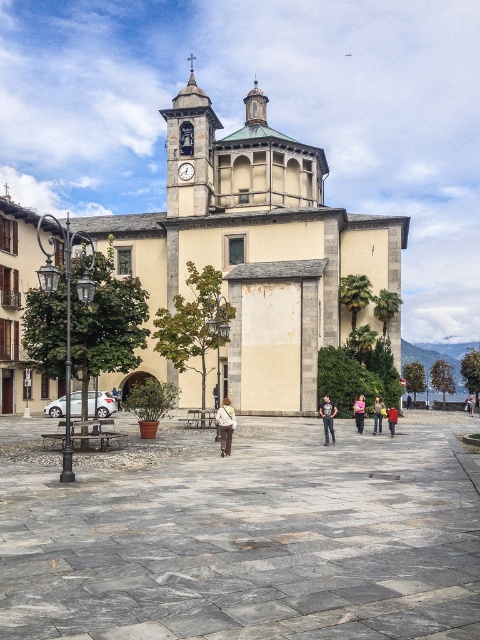
Question: Is dark blue jeans at center to the right of denim jacket at center from the viewer's perspective?

Choices:
 (A) no
 (B) yes

Answer: (A)

Question: Which of the following is the farthest from the observer?

Choices:
 (A) (233, 413)
 (B) (294, 609)

Answer: (A)

Question: Can you confirm if yellow stone church at center is bigger than dark blue jeans at center?

Choices:
 (A) no
 (B) yes

Answer: (B)

Question: Which point is closer to the camera?

Choices:
 (A) gray stone pavement at center
 (B) light brown leather jacket at center
 (C) yellow stone church at center

Answer: (A)

Question: Which object appears closest to the camera in this image?

Choices:
 (A) metallic clock at center
 (B) yellow stone church at center
 (C) dark blue jeans at center
 (D) gray stone pavement at center

Answer: (D)

Question: Does gray stone pavement at center have a lesser width compared to pink fabric at center?

Choices:
 (A) no
 (B) yes

Answer: (A)